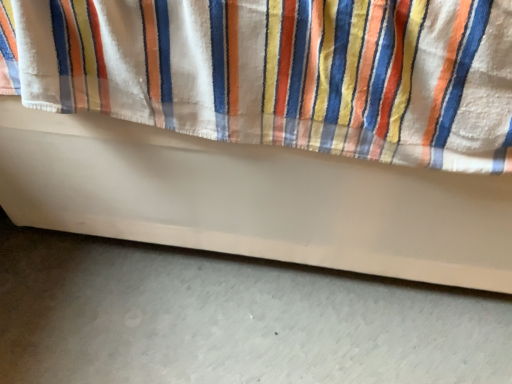
Identify the location of gray matte concrete at lower center. (230, 319).

The image size is (512, 384). What do you see at coordinates (230, 319) in the screenshot? I see `gray matte concrete at lower center` at bounding box center [230, 319].

Locate an element on the screen. gray matte concrete at lower center is located at coordinates (230, 319).